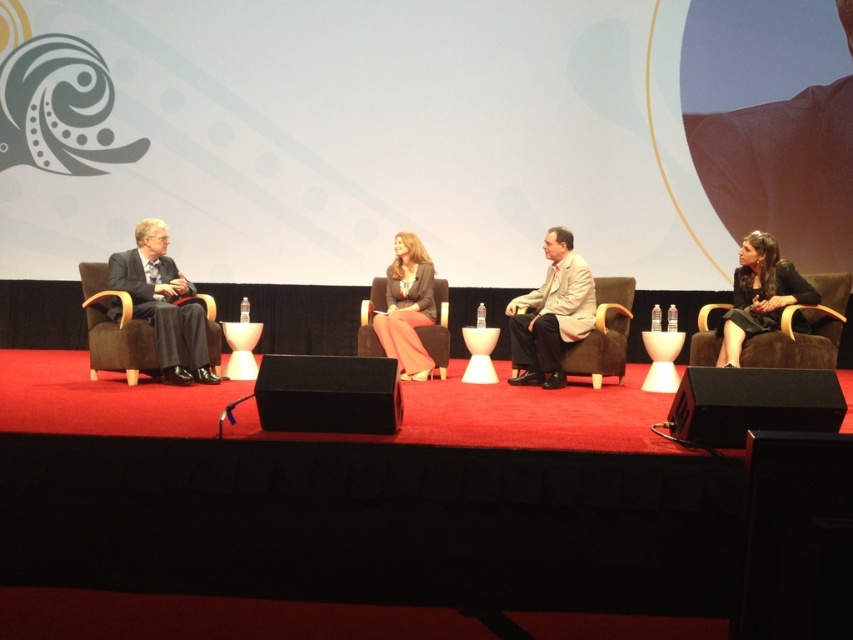
You are sitting in the audience and want to focus your camera on both point (746, 252) and point (213, 324). Which point should you adjust your focus for first to ensure both are in clear view?

Point (746, 252) is closer to the camera than point (213, 324), so you should focus on point (746, 252) first to ensure both are in clear view.

You are sitting in the audience and want to point out two specific points on the stage. Which of the two points, point (134, 356) or point (616, 298), is closer to you?

Point (134, 356) is closer to the viewer than point (616, 298).